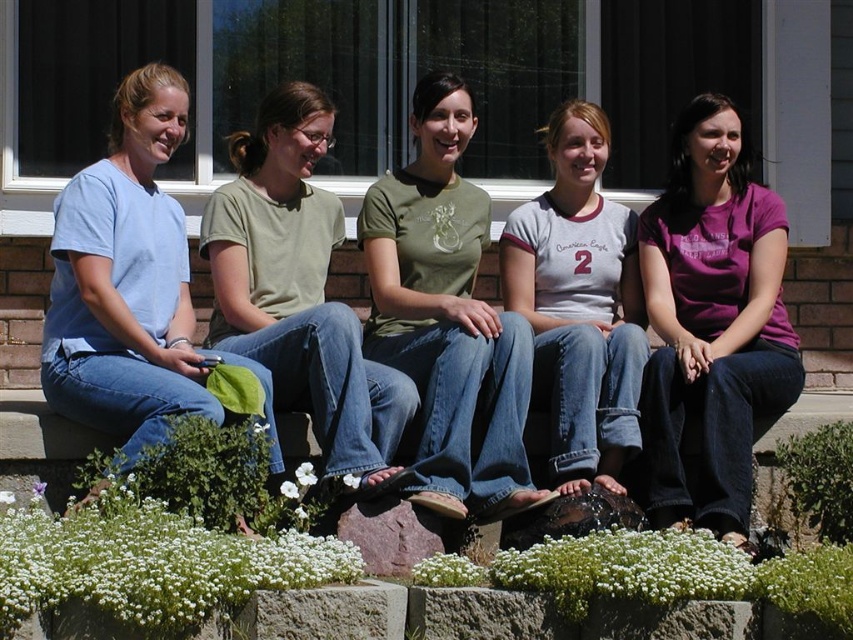
Is light blue t-shirt at left to the right of matte green t-shirt at center from the viewer's perspective?

Incorrect, light blue t-shirt at left is not on the right side of matte green t-shirt at center.

The width and height of the screenshot is (853, 640). I want to click on light blue t-shirt at left, so click(129, 282).

Is point (90, 419) farther from camera compared to point (306, 310)?

No, (90, 419) is in front of (306, 310).

Locate an element on the screen. light blue t-shirt at left is located at coordinates (129, 282).

Is matte green t-shirt at center further to the viewer compared to matte gray t-shirt at center?

No, matte green t-shirt at center is closer to the viewer.

Does matte green t-shirt at center have a lesser width compared to matte gray t-shirt at center?

Correct, matte green t-shirt at center's width is less than matte gray t-shirt at center's.

Does point (202, 227) lie behind point (575, 257)?

No, (202, 227) is in front of (575, 257).

Locate an element on the screen. This screenshot has height=640, width=853. matte green t-shirt at center is located at coordinates (299, 289).

Between purple cotton shirt at center and matte green t-shirt at center, which one appears on the left side from the viewer's perspective?

matte green t-shirt at center is more to the left.

Is purple cotton shirt at center shorter than matte green t-shirt at center?

Correct, purple cotton shirt at center is not as tall as matte green t-shirt at center.

Is point (741, 540) positioned after point (294, 104)?

No, (741, 540) is in front of (294, 104).

The height and width of the screenshot is (640, 853). I want to click on purple cotton shirt at center, so click(712, 321).